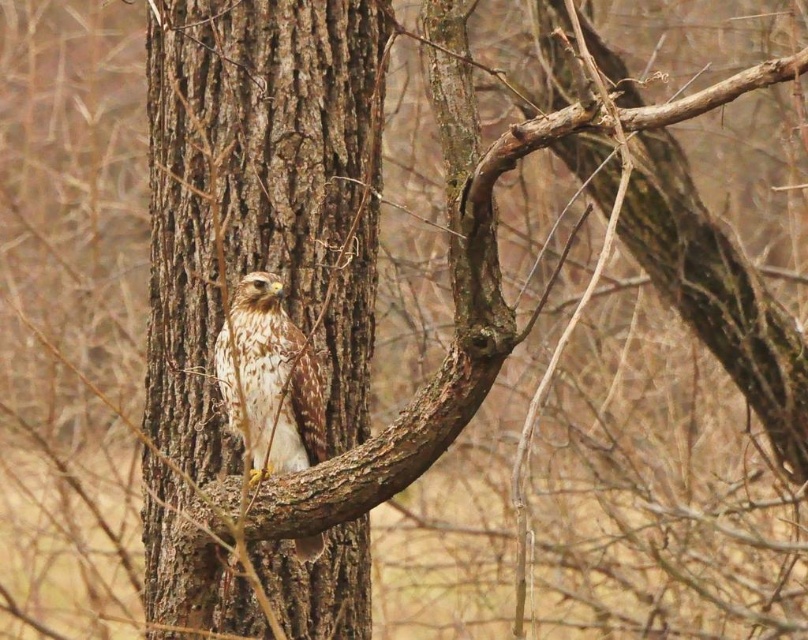
Can you confirm if brown rough bark tree trunk at center is smaller than brown speckled feathers at center?

Actually, brown rough bark tree trunk at center might be larger than brown speckled feathers at center.

Which is behind, point (213, 563) or point (322, 376)?

Positioned behind is point (322, 376).

Find the location of a particular element. brown rough bark tree trunk at center is located at coordinates (259, 196).